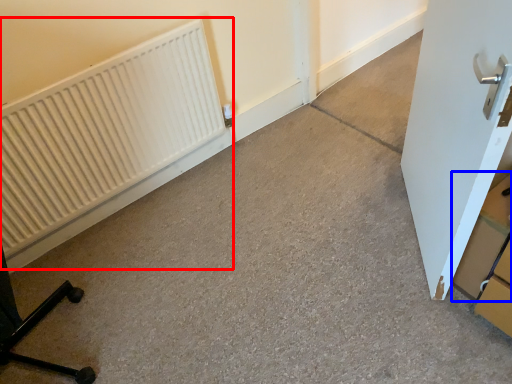
Question: Which object is further to the camera taking this photo, radiator (highlighted by a red box) or cardboard box (highlighted by a blue box)?

Choices:
 (A) radiator
 (B) cardboard box

Answer: (A)